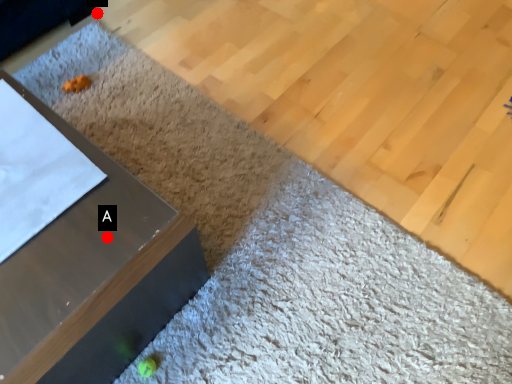
Question: Two points are circled on the image, labeled by A and B beside each circle. Among these points, which one is farthest from the camera?

Choices:
 (A) A is further
 (B) B is further

Answer: (B)